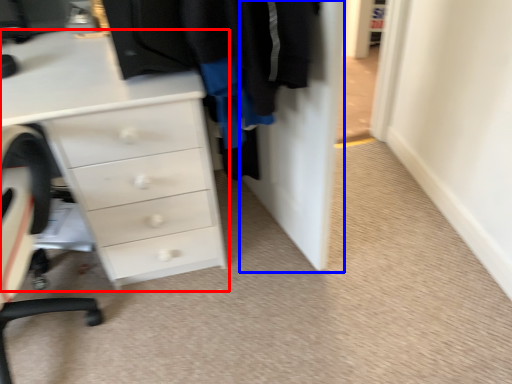
Question: Which of the following is the closest to the observer, chest of drawers (highlighted by a red box) or door (highlighted by a blue box)?

Choices:
 (A) chest of drawers
 (B) door

Answer: (B)